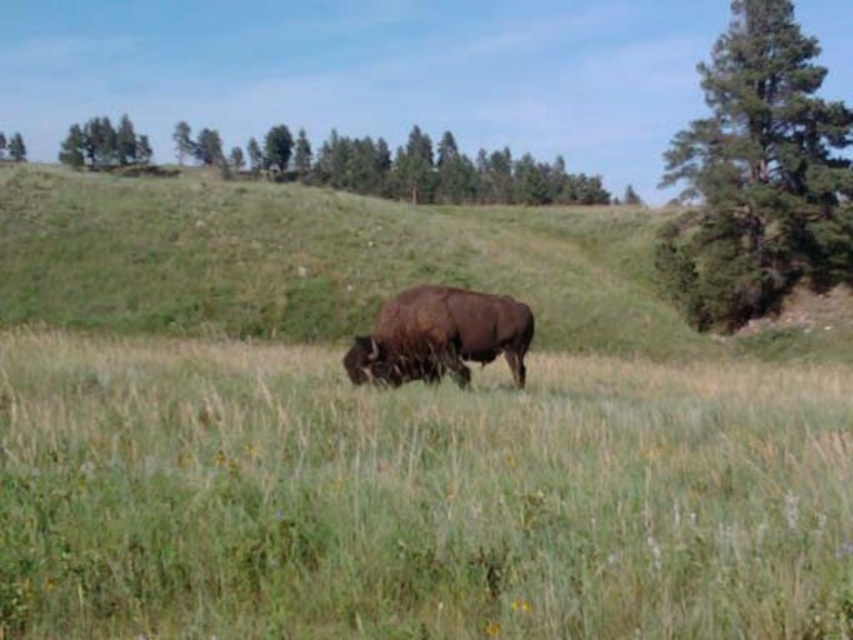
You are standing in the grassy field and see a bison grazing in the foreground. There is a point marked at coordinates [758,173]. Which object from the scene does this point belong to?

The point at coordinates [758,173] is on the green textured tree at upper right.

You are a photographer standing in the grassy field. You want to capture a photo where the brown furry buffalo at center and the green leafy tree at upper left are both visible. Considering their sizes, which object will appear smaller in the photo?

The brown furry buffalo at center will appear smaller in the photo because its width is less than the green leafy tree at upper left.

You are standing in the grassy field and want to take a photo of the green textured tree at upper right. Based on its position, in which general direction should you point your camera to capture it?

The green textured tree at upper right is located at point 0.273 on the horizontal axis and 0.890 on the vertical axis, meaning it is positioned towards the upper right of the image. To capture it, you should point your camera in the upper right direction.